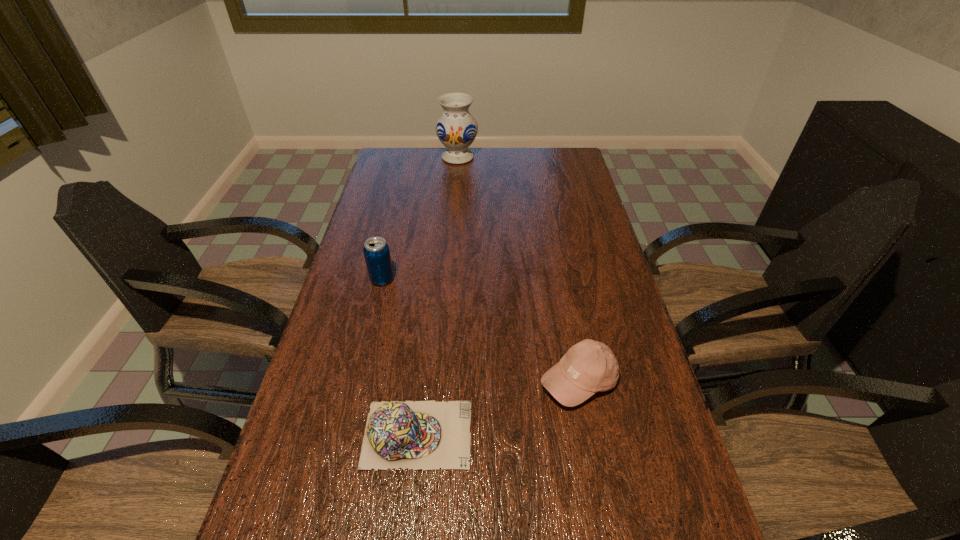
The image size is (960, 540). What are the coordinates of `empty space that is in between the baseball cap and the pop soda` in the screenshot? It's located at (481, 330).

The image size is (960, 540). Identify the location of unoccupied position between the rightmost object and the vase. (518, 269).

The image size is (960, 540). What are the coordinates of `empty space between the pop soda and the rightmost object` in the screenshot? It's located at [481, 330].

Find the location of a particular element. Image resolution: width=960 pixels, height=540 pixels. vacant area between the leftmost object and the shortest object is located at coordinates (400, 357).

The width and height of the screenshot is (960, 540). What are the coordinates of `empty location between the baseball cap and the vase` in the screenshot? It's located at (518, 269).

The height and width of the screenshot is (540, 960). In order to click on vacant area between the pop soda and the baseball cap in this screenshot , I will do `click(481, 330)`.

Identify the location of free area in between the second farthest object and the rightmost object. The width and height of the screenshot is (960, 540). (481, 330).

Where is `free area in between the farthest object and the baseball cap`? free area in between the farthest object and the baseball cap is located at coordinates click(x=518, y=269).

Identify the location of empty space between the vase and the baseball cap. Image resolution: width=960 pixels, height=540 pixels. (518, 269).

What are the coordinates of `blank region between the farthest object and the shortest object` in the screenshot? It's located at (438, 296).